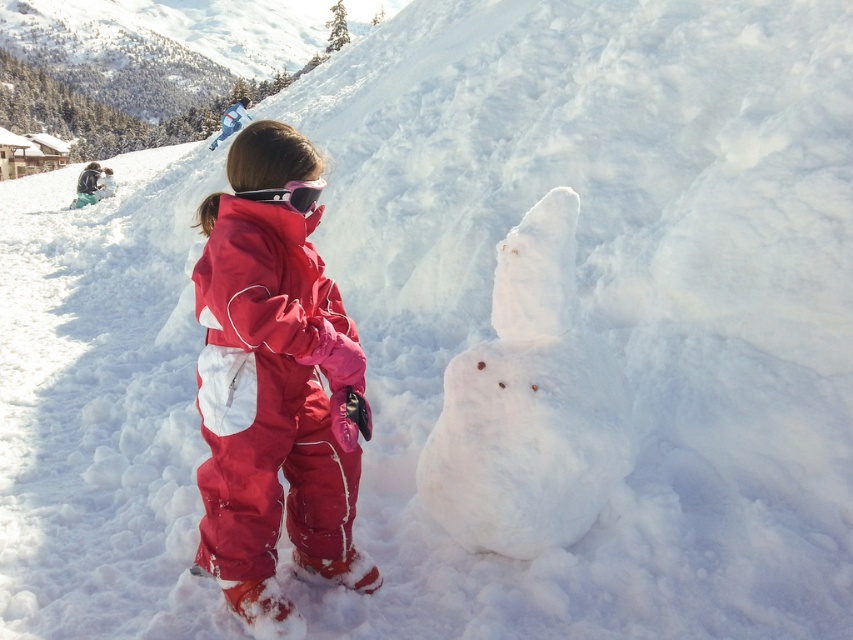
Question: Is white fluffy snowman at center below red matte snowsuit at center?

Choices:
 (A) no
 (B) yes

Answer: (B)

Question: Is white fluffy snowman at center to the right of pink matte goggles at center from the viewer's perspective?

Choices:
 (A) no
 (B) yes

Answer: (B)

Question: Can you confirm if white fluffy snowman at center is positioned to the left of red matte snowsuit at center?

Choices:
 (A) yes
 (B) no

Answer: (B)

Question: Which point appears closest to the camera in this image?

Choices:
 (A) (213, 468)
 (B) (575, 465)
 (C) (235, 193)
 (D) (218, 362)

Answer: (C)

Question: Which object appears closest to the camera in this image?

Choices:
 (A) white fluffy snowman at center
 (B) red matte snowsuit at center
 (C) matte red snowsuit at center
 (D) pink matte goggles at center

Answer: (B)

Question: Estimate the real-world distances between objects in this image. Which object is closer to the pink matte goggles at center?

Choices:
 (A) matte red snowsuit at center
 (B) white fluffy snowman at center

Answer: (A)